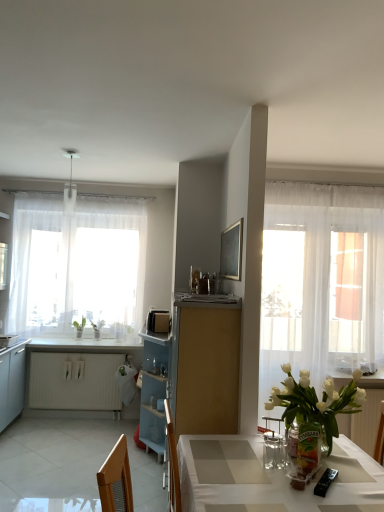
This screenshot has height=512, width=384. Identify the location of free point in front of transparent glass vase at center-right. (330, 488).